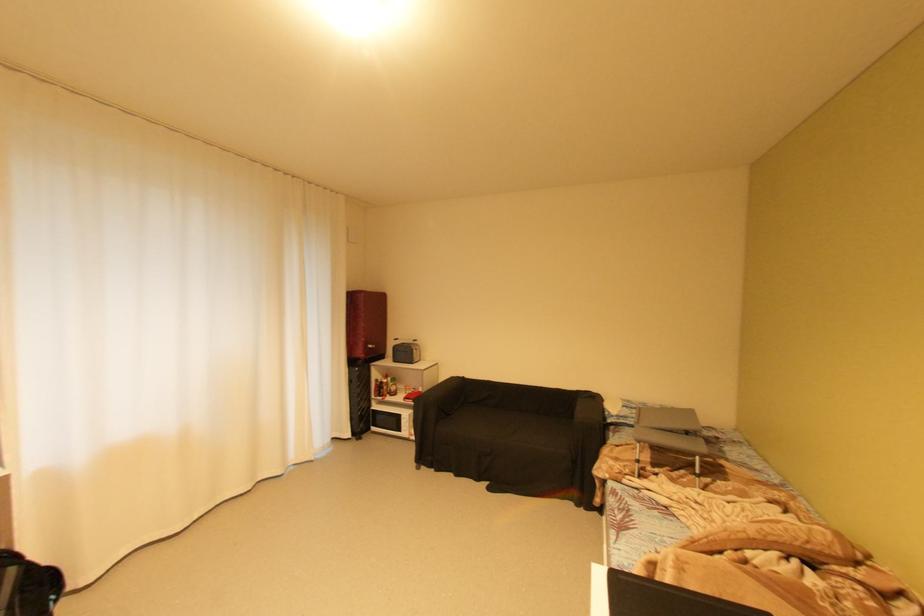
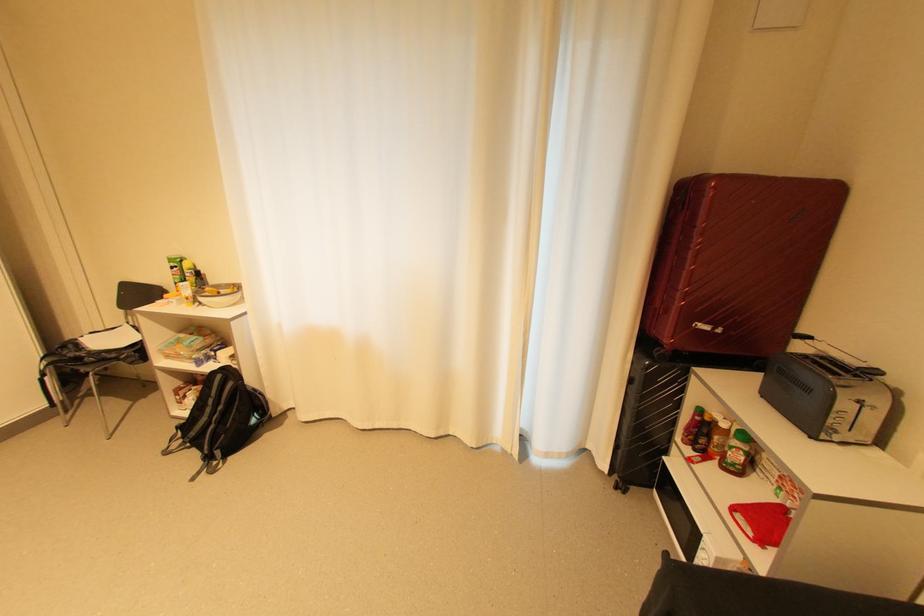
Locate, in the second image, the point that corresponds to (421,362) in the first image.

(830, 439)